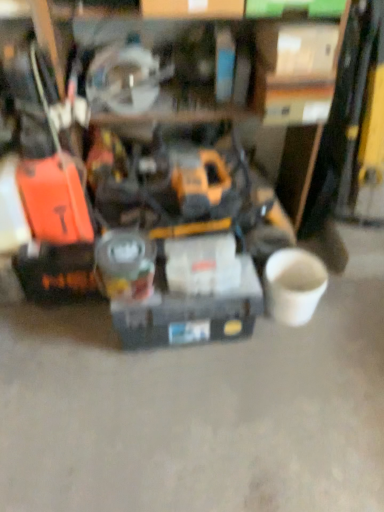
Question: Is matte gray toolbox at center, the first box from the left, at the back of white cardboard box at upper center, which ranks as the second box in left-to-right order?

Choices:
 (A) no
 (B) yes

Answer: (A)

Question: Is white cardboard box at upper center, which is counted as the 2th box, starting from the bottom, taller than matte gray toolbox at center, the 2th box in the right-to-left sequence?

Choices:
 (A) yes
 (B) no

Answer: (B)

Question: From the image's perspective, is white cardboard box at upper center, which is the first box in right-to-left order, beneath matte gray toolbox at center, the first box from the left?

Choices:
 (A) no
 (B) yes

Answer: (A)

Question: Is white cardboard box at upper center, which ranks as the second box in left-to-right order, at the left side of matte gray toolbox at center, the first box from the left?

Choices:
 (A) yes
 (B) no

Answer: (B)

Question: Is white cardboard box at upper center, the first box from the top, to the right of matte gray toolbox at center, the first box from the left, from the viewer's perspective?

Choices:
 (A) yes
 (B) no

Answer: (A)

Question: Does point (321, 74) appear closer or farther from the camera than point (240, 331)?

Choices:
 (A) farther
 (B) closer

Answer: (B)

Question: Relative to matte gray toolbox at center, which is the second box in top-to-bottom order, is white cardboard box at upper center, which is the first box in right-to-left order, in front or behind?

Choices:
 (A) behind
 (B) front

Answer: (B)

Question: Is white cardboard box at upper center, which ranks as the second box in left-to-right order, wider or thinner than matte gray toolbox at center, the first box from the left?

Choices:
 (A) thin
 (B) wide

Answer: (B)

Question: Visually, is white cardboard box at upper center, which ranks as the second box in left-to-right order, positioned to the left or to the right of matte gray toolbox at center, positioned as the first box in bottom-to-top order?

Choices:
 (A) left
 (B) right

Answer: (B)

Question: Based on their sizes in the image, would you say matte gray toolbox at center, the first box from the left, is bigger or smaller than yellow/black plastic drill at center?

Choices:
 (A) small
 (B) big

Answer: (A)

Question: Is matte gray toolbox at center, positioned as the first box in bottom-to-top order, taller or shorter than yellow/black plastic drill at center?

Choices:
 (A) tall
 (B) short

Answer: (B)

Question: From the image's perspective, is matte gray toolbox at center, positioned as the first box in bottom-to-top order, above or below yellow/black plastic drill at center?

Choices:
 (A) below
 (B) above

Answer: (A)

Question: Is matte gray toolbox at center, the first box from the left, situated inside yellow/black plastic drill at center or outside?

Choices:
 (A) inside
 (B) outside

Answer: (B)

Question: Is yellow/black plastic drill at center bigger or smaller than white cardboard box at upper center, the first box from the top?

Choices:
 (A) small
 (B) big

Answer: (B)

Question: Is yellow/black plastic drill at center in front of or behind white cardboard box at upper center, which is counted as the 2th box, starting from the bottom, in the image?

Choices:
 (A) front
 (B) behind

Answer: (A)